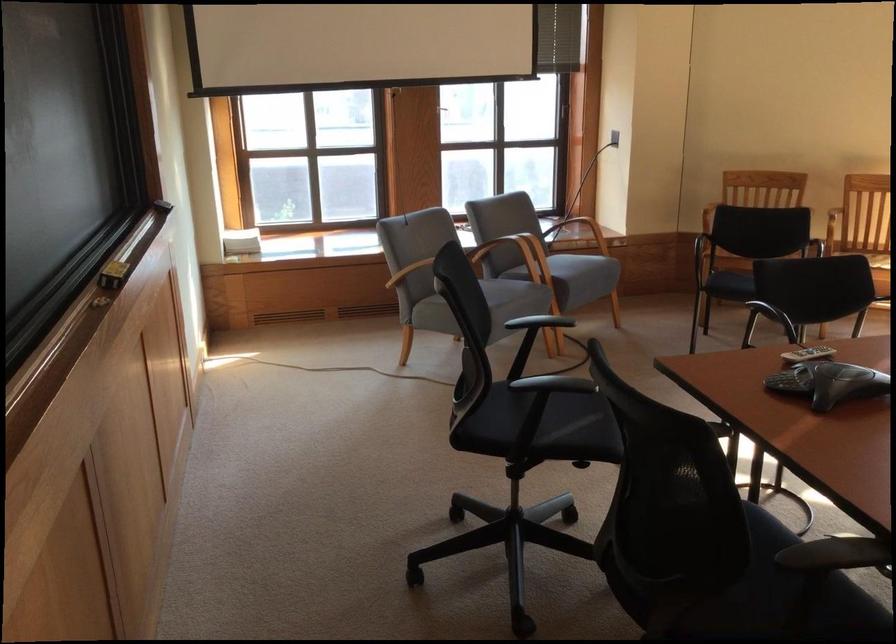
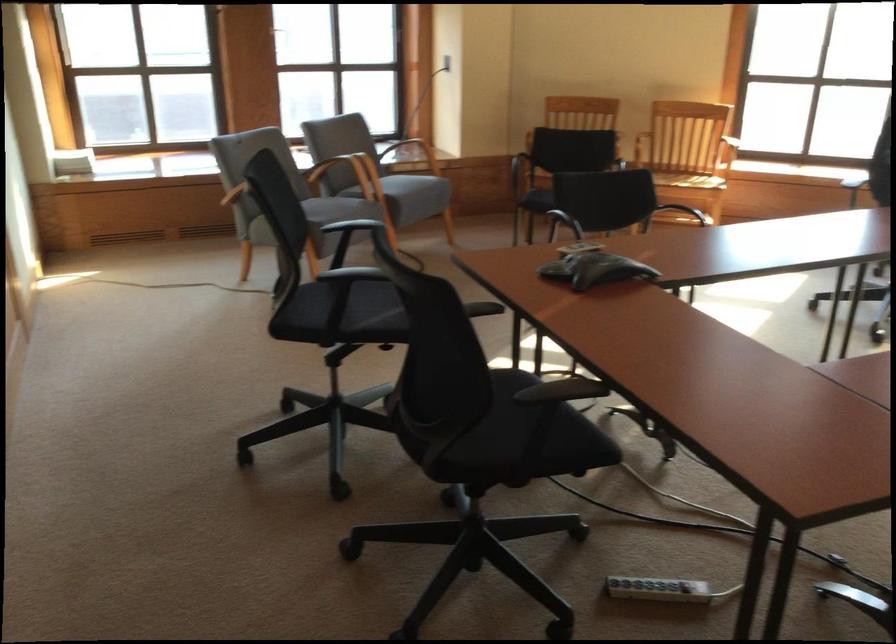
The point at (810, 292) is marked in the first image. Where is the corresponding point in the second image?

(602, 201)